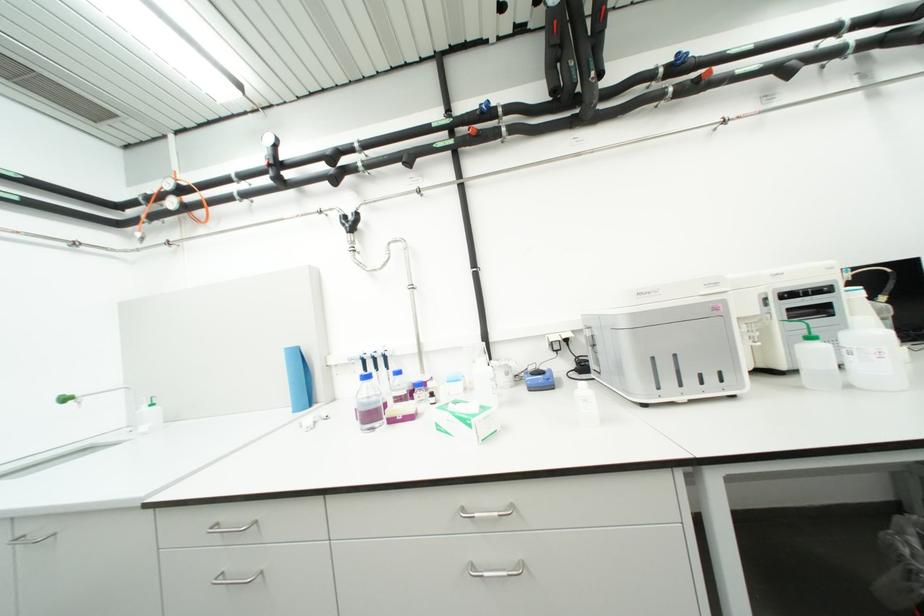
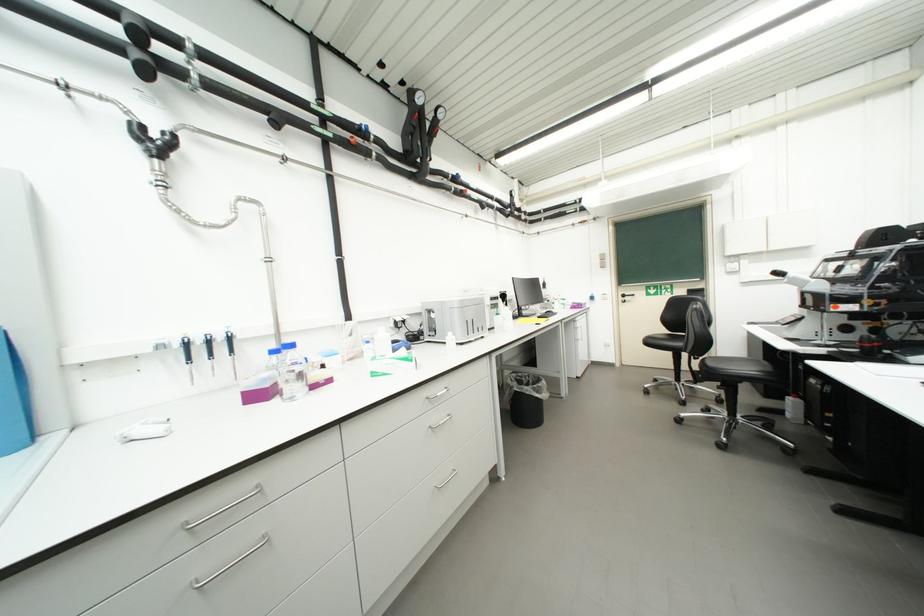
Question: The camera is either moving clockwise (left) or counter-clockwise (right) around the object. The first image is from the beginning of the video and the second image is from the end. Is the camera moving left or right when shooting the video?

Choices:
 (A) Left
 (B) Right

Answer: (A)